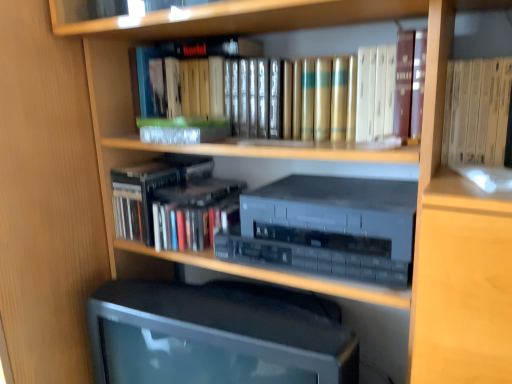
Locate an element on the screen. The width and height of the screenshot is (512, 384). vacant space situated above satin silver stereo at center (from a real-world perspective) is located at coordinates (341, 191).